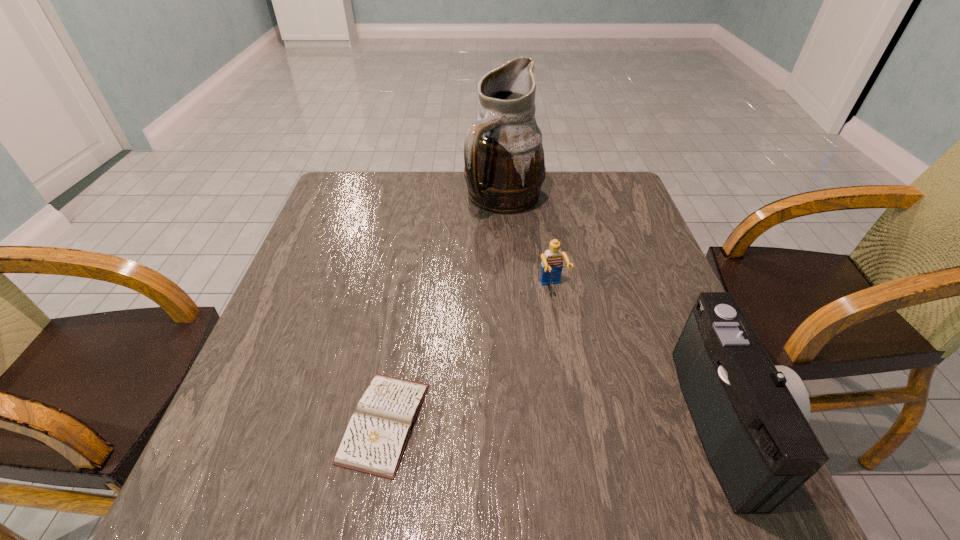
The image size is (960, 540). I want to click on vacant space situated on the face of the second farthest object, so click(x=568, y=327).

Locate an element on the screen. The image size is (960, 540). free space located on the face of the second farthest object is located at coordinates (578, 353).

What are the coordinates of `free space located from the spout of the farthest object` in the screenshot? It's located at (528, 322).

In order to click on vacant region located from the spout of the farthest object in this screenshot , I will do `click(520, 281)`.

Where is `free space located from the spout of the farthest object`? free space located from the spout of the farthest object is located at coordinates (531, 333).

Where is `object located at the far edge`? This screenshot has height=540, width=960. object located at the far edge is located at coordinates (504, 160).

Locate an element on the screen. diary at the near edge is located at coordinates (376, 436).

Identify the location of camcorder that is positioned at the near edge. (751, 416).

Identify the location of object that is positioned at the right edge. (751, 416).

Find the location of `object at the near right corner`. object at the near right corner is located at coordinates (751, 416).